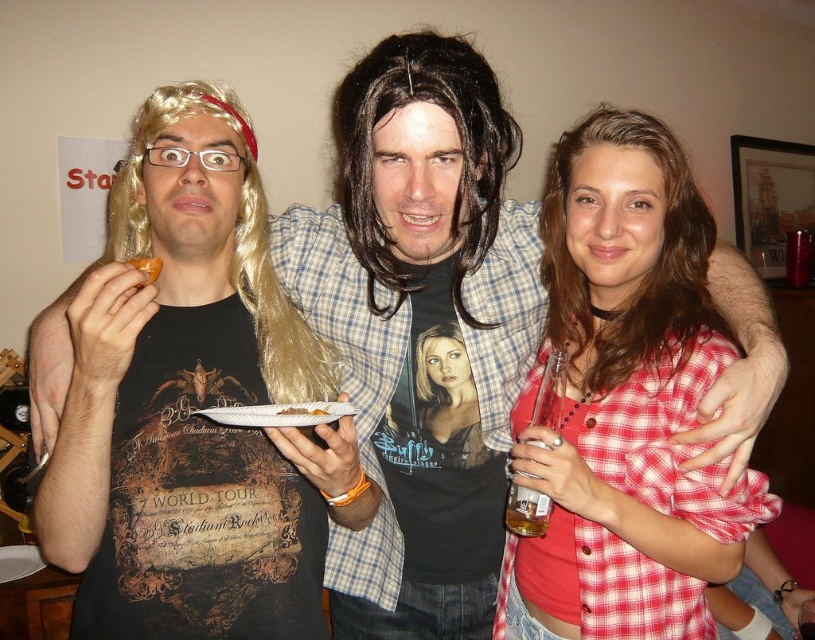
Question: Can you confirm if orange flesh at center is positioned to the right of savory meat at plate center?

Choices:
 (A) yes
 (B) no

Answer: (B)

Question: Which of these objects is positioned farthest from the savory meat at plate center?

Choices:
 (A) matte red plaid shirt at center
 (B) white paper plate at center

Answer: (A)

Question: Which of these objects is positioned closest to the matte red plaid shirt at center?

Choices:
 (A) savory meat at plate center
 (B) orange flesh at center
 (C) smooth black fabric at center
 (D) white paper plate at center

Answer: (C)

Question: Which of the following is the closest to the observer?

Choices:
 (A) (637, 561)
 (B) (223, 420)
 (C) (326, 410)
 (D) (465, 451)

Answer: (B)

Question: From the image, what is the correct spatial relationship of smooth black fabric at center in relation to savory meat at plate center?

Choices:
 (A) below
 (B) above

Answer: (A)

Question: Does smooth black fabric at center have a greater width compared to orange flesh at center?

Choices:
 (A) no
 (B) yes

Answer: (B)